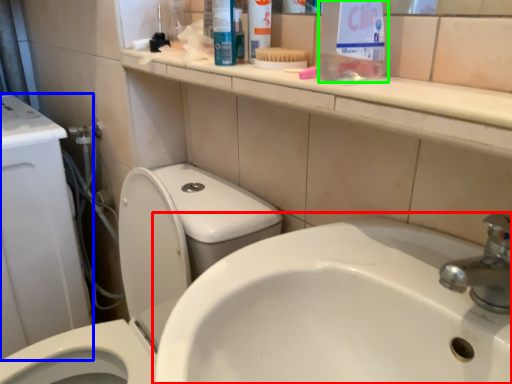
Question: Which is farther away from sink (highlighted by a red box)? porcelain (highlighted by a blue box) or cleaning product (highlighted by a green box)?

Choices:
 (A) porcelain
 (B) cleaning product

Answer: (A)